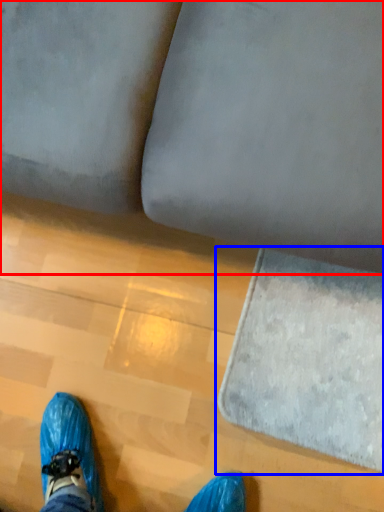
Question: Which point is closer to the camera, studio couch (highlighted by a red box) or mat (highlighted by a blue box)?

Choices:
 (A) studio couch
 (B) mat

Answer: (A)